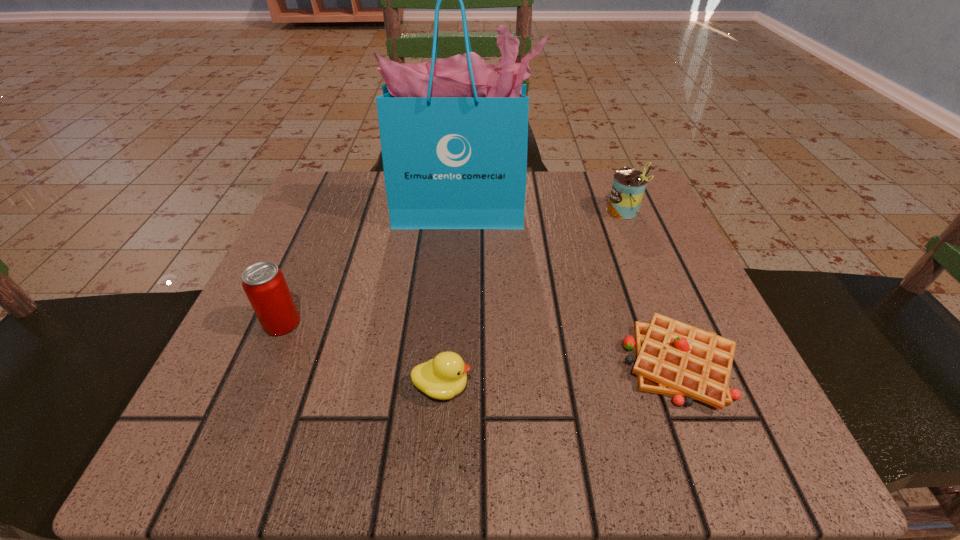
Locate an element on the screen. vacant space at the far edge of the desktop is located at coordinates (569, 191).

I want to click on vacant space at the near edge, so click(x=377, y=461).

The image size is (960, 540). I want to click on free region at the left edge, so click(x=299, y=347).

Find the location of a particular element. vacant space at the right edge is located at coordinates (678, 319).

Locate an element on the screen. The image size is (960, 540). vacant space at the far left corner is located at coordinates (336, 181).

Where is `free location at the far right corner`? This screenshot has height=540, width=960. free location at the far right corner is located at coordinates (582, 176).

Locate an element on the screen. This screenshot has width=960, height=540. free space between the shopping bag and the second shortest object is located at coordinates (452, 300).

At what (x,y) coordinates should I click in order to perform the action: click on vacant area that lies between the leftmost object and the duckling. Please return your answer as a coordinate pair (x, y). This screenshot has height=540, width=960. Looking at the image, I should click on (362, 355).

Find the location of a particular element. The height and width of the screenshot is (540, 960). free point between the waffle and the nearer can is located at coordinates tap(481, 343).

Where is `free space between the leftmost object and the waffle`? The image size is (960, 540). free space between the leftmost object and the waffle is located at coordinates (481, 343).